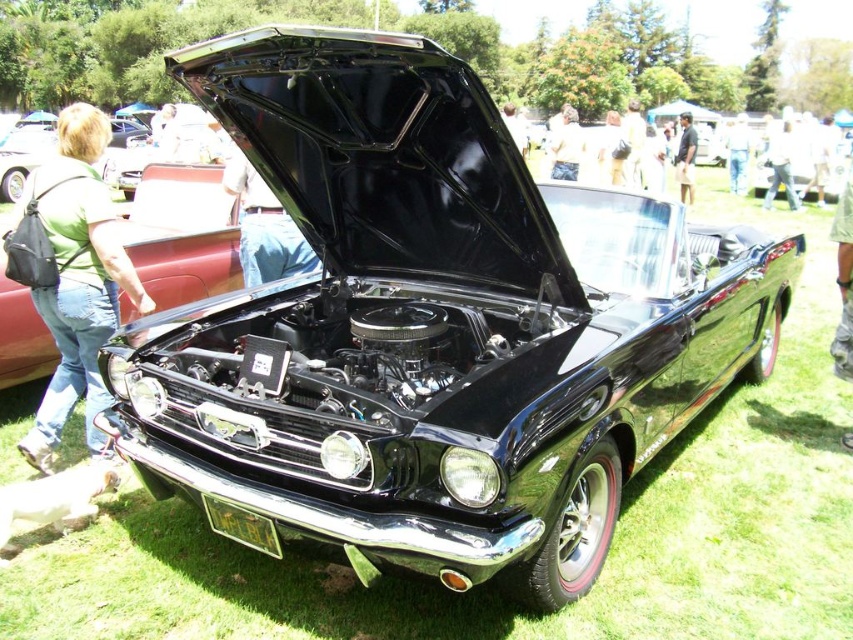
You are standing at the front of the classic black convertible car at the car show. There are two points marked on the car, one at coordinates point (33, 266) and the other at point (692, 163). Which point is closer to you?

Point (33, 266) is in front of point (692, 163), so the point closer to you is point (33, 266).

Looking at this image, you are a photographer setting up a tripod to take a picture of the classic black convertible car at the car show. You notice a green fabric backpack at left and denim pants at center in your shot. Which object should you move to avoid blocking the car, and why?

You should move the green fabric backpack at left because it is not as tall as the denim pants at center, so it might be blocking the lower part of the car in your shot.